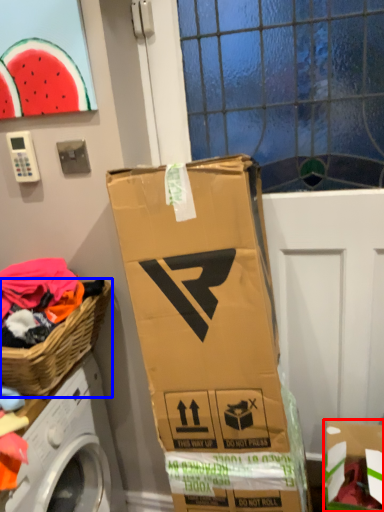
Question: Which of the following is the closest to the observer, cardboard box (highlighted by a red box) or picnic basket (highlighted by a blue box)?

Choices:
 (A) cardboard box
 (B) picnic basket

Answer: (B)